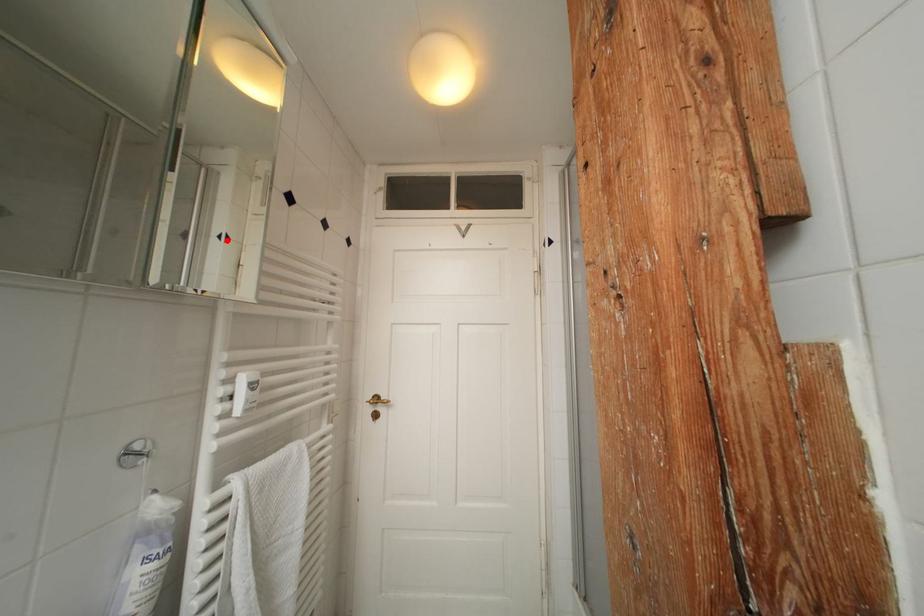
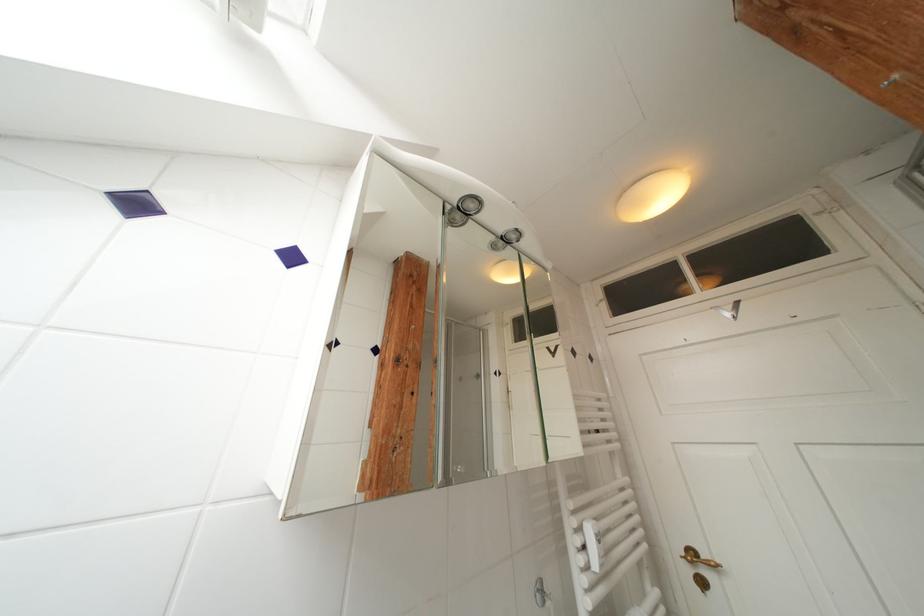
Question: I am providing you with two images of the same scene from different viewpoints. Image1 has a red point marked. In image2, the corresponding 3D location appears at what relative position? Reply with the corresponding letter.

Choices:
 (A) Closer
 (B) Farther

Answer: (B)